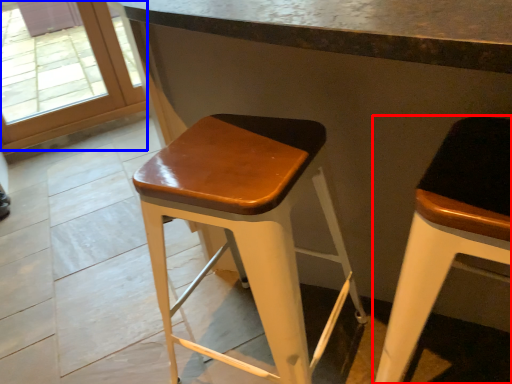
Question: Which point is closer to the camera, stool (highlighted by a red box) or glass door (highlighted by a blue box)?

Choices:
 (A) stool
 (B) glass door

Answer: (A)